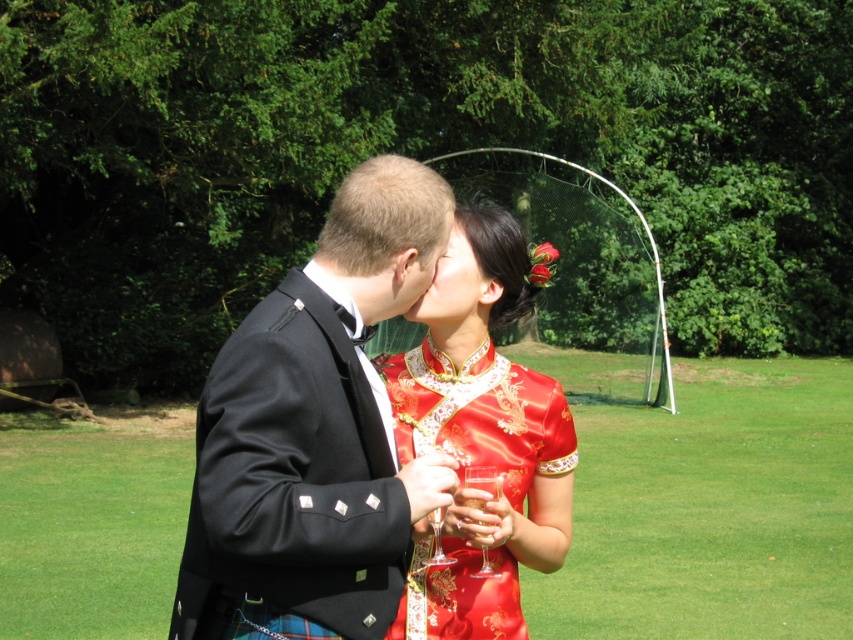
Who is positioned more to the right, black satin suit at center or silky red dress at center?

From the viewer's perspective, silky red dress at center appears more on the right side.

Consider the image. Is black satin suit at center further to the viewer compared to silky red dress at center?

No, it is not.

Is point (393, 520) positioned after point (523, 259)?

No.

This screenshot has height=640, width=853. Identify the location of black satin suit at center. (314, 433).